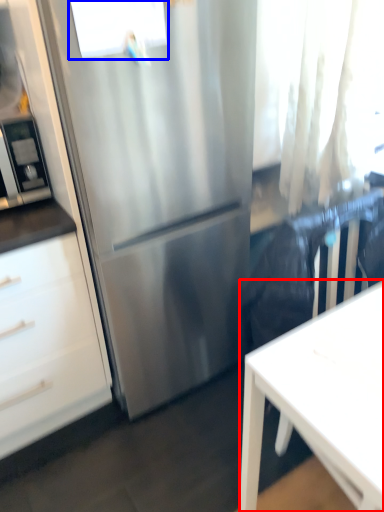
Question: Which object appears closest to the camera in this image, desk (highlighted by a red box) or window (highlighted by a blue box)?

Choices:
 (A) desk
 (B) window

Answer: (A)